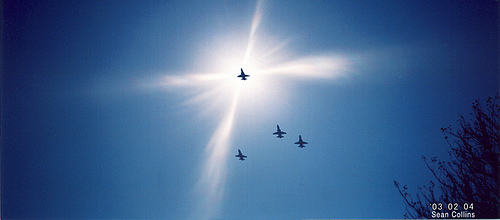
The width and height of the screenshot is (500, 220). I want to click on light source, so click(235, 71).